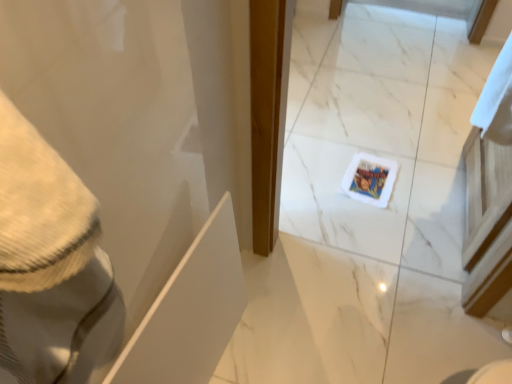
Find the location of `white plastic container at center`. white plastic container at center is located at coordinates (370, 179).

What is the approximate height of white plastic container at center?

It is 1.08 inches.

What do you see at coordinates (370, 179) in the screenshot?
I see `white plastic container at center` at bounding box center [370, 179].

Locate an element on the screen. This screenshot has height=384, width=512. white plastic container at center is located at coordinates (370, 179).